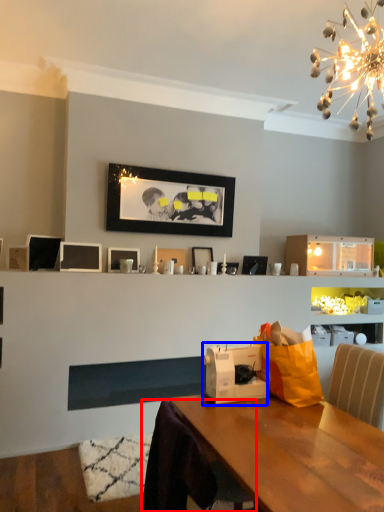
Question: Among these objects, which one is nearest to the camera, swivel chair (highlighted by a red box) or appliance (highlighted by a blue box)?

Choices:
 (A) swivel chair
 (B) appliance

Answer: (A)